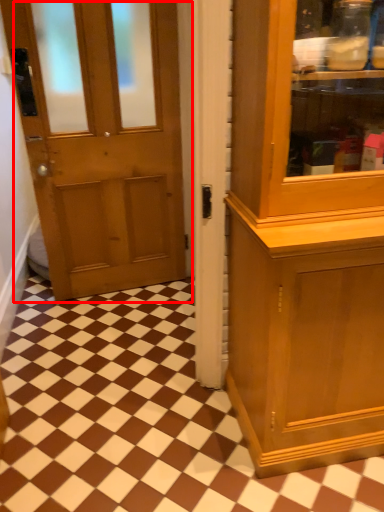
Question: From the image's perspective, considering the relative positions of door (annotated by the red box) and tile in the image provided, where is door (annotated by the red box) located with respect to the staircase?

Choices:
 (A) below
 (B) above

Answer: (B)